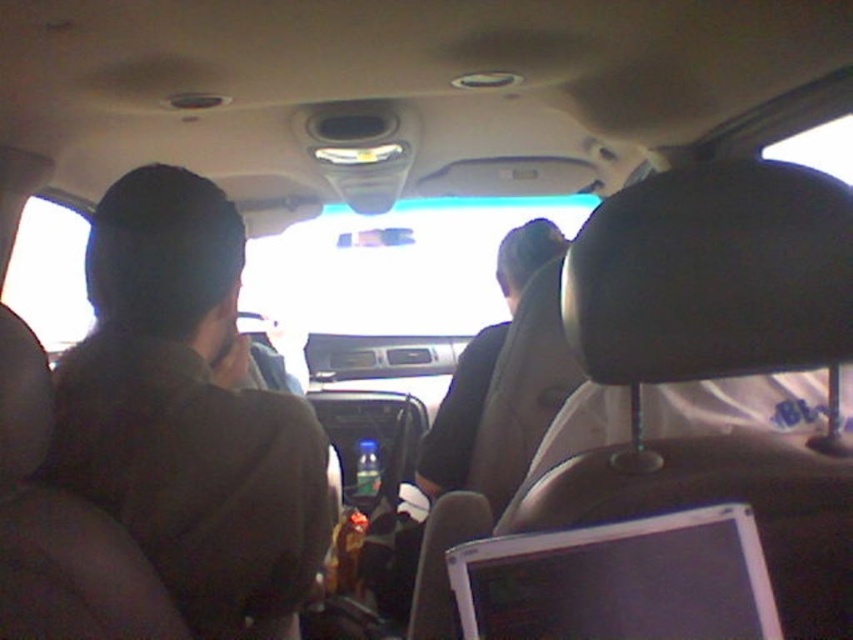
Question: Considering the real-world distances, which object is closest to the silver plastic laptop at lower right?

Choices:
 (A) dark brown fabric at left
 (B) black fabric shirt at center

Answer: (A)

Question: Where is dark brown fabric at left located in relation to silver plastic laptop at lower right in the image?

Choices:
 (A) left
 (B) right

Answer: (A)

Question: Is silver plastic laptop at lower right thinner than black fabric shirt at center?

Choices:
 (A) no
 (B) yes

Answer: (B)

Question: Which object is the farthest from the dark brown fabric at left?

Choices:
 (A) black fabric shirt at center
 (B) silver plastic laptop at lower right

Answer: (A)

Question: Can you confirm if dark brown fabric at left is positioned below black fabric shirt at center?

Choices:
 (A) no
 (B) yes

Answer: (B)

Question: Which point is farther to the camera?

Choices:
 (A) silver plastic laptop at lower right
 (B) black fabric shirt at center

Answer: (B)